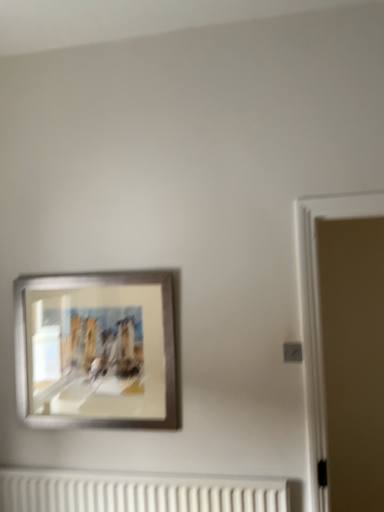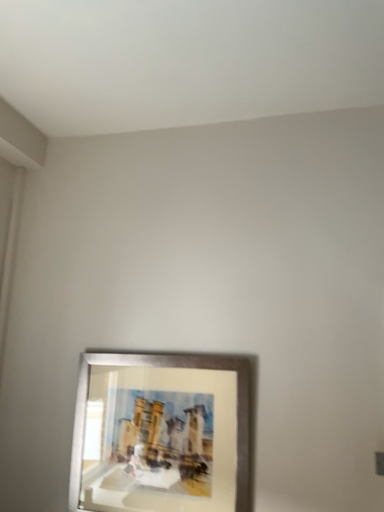
Question: Which way did the camera rotate in the video?

Choices:
 (A) rotated downward
 (B) rotated upward

Answer: (B)